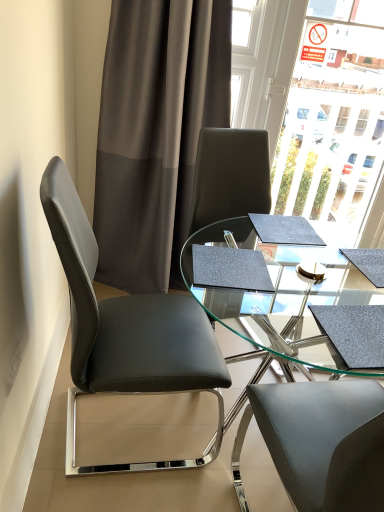
Question: From the image's perspective, is transparent glass table at center on dark grey sheer curtain at upper left?

Choices:
 (A) yes
 (B) no

Answer: (B)

Question: Does transparent glass table at center have a greater width compared to dark grey sheer curtain at upper left?

Choices:
 (A) yes
 (B) no

Answer: (A)

Question: From the image's perspective, would you say transparent glass table at center is shown under dark grey sheer curtain at upper left?

Choices:
 (A) no
 (B) yes

Answer: (B)

Question: Considering the relative sizes of transparent glass table at center and dark grey sheer curtain at upper left in the image provided, is transparent glass table at center shorter than dark grey sheer curtain at upper left?

Choices:
 (A) yes
 (B) no

Answer: (A)

Question: Is transparent glass table at center facing towards dark grey sheer curtain at upper left?

Choices:
 (A) no
 (B) yes

Answer: (A)

Question: Does transparent glass table at center lie behind dark grey sheer curtain at upper left?

Choices:
 (A) yes
 (B) no

Answer: (B)

Question: Does black leather chair at left lie behind dark grey sheer curtain at upper left?

Choices:
 (A) yes
 (B) no

Answer: (B)

Question: Does black leather chair at left appear on the left side of dark grey sheer curtain at upper left?

Choices:
 (A) yes
 (B) no

Answer: (A)

Question: Is black leather chair at left looking in the opposite direction of dark grey sheer curtain at upper left?

Choices:
 (A) no
 (B) yes

Answer: (A)

Question: Are black leather chair at left and dark grey sheer curtain at upper left beside each other?

Choices:
 (A) no
 (B) yes

Answer: (A)

Question: From the image's perspective, is black leather chair at left on top of dark grey sheer curtain at upper left?

Choices:
 (A) no
 (B) yes

Answer: (A)

Question: Is black leather chair at left located outside dark grey sheer curtain at upper left?

Choices:
 (A) yes
 (B) no

Answer: (A)

Question: Considering the relative sizes of transparent glass table at center and black leather chair at left in the image provided, is transparent glass table at center smaller than black leather chair at left?

Choices:
 (A) no
 (B) yes

Answer: (A)